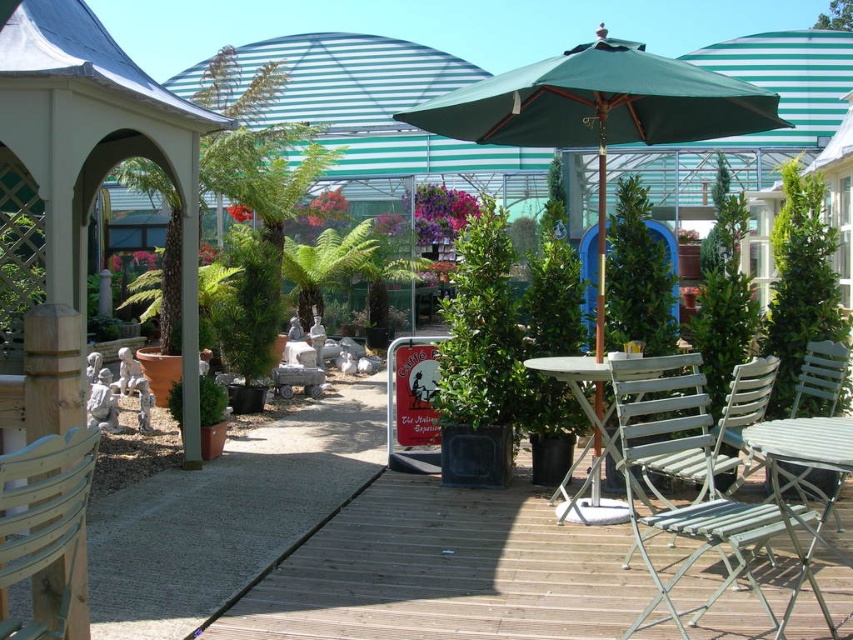
Can you confirm if green leafy bush at center is smaller than green leafy plant at left?

Actually, green leafy bush at center might be larger than green leafy plant at left.

I want to click on green leafy bush at center, so click(x=799, y=282).

Identify the location of green leafy bush at center. The height and width of the screenshot is (640, 853). (799, 282).

Locate an element on the screen. This screenshot has width=853, height=640. wooden deck at center is located at coordinates (444, 572).

Which is in front, point (415, 604) or point (598, 44)?

Positioned in front is point (415, 604).

What are the coordinates of `wooden deck at center` in the screenshot? It's located at (444, 572).

Who is higher up, light brown wooden chair at lower left or green leafy plant at left?

green leafy plant at left is higher up.

Does light brown wooden chair at lower left lie behind green leafy plant at left?

No.

Which is behind, point (76, 472) or point (30, 250)?

The point (30, 250) is behind.

Locate an element on the screen. Image resolution: width=853 pixels, height=640 pixels. light brown wooden chair at lower left is located at coordinates (44, 520).